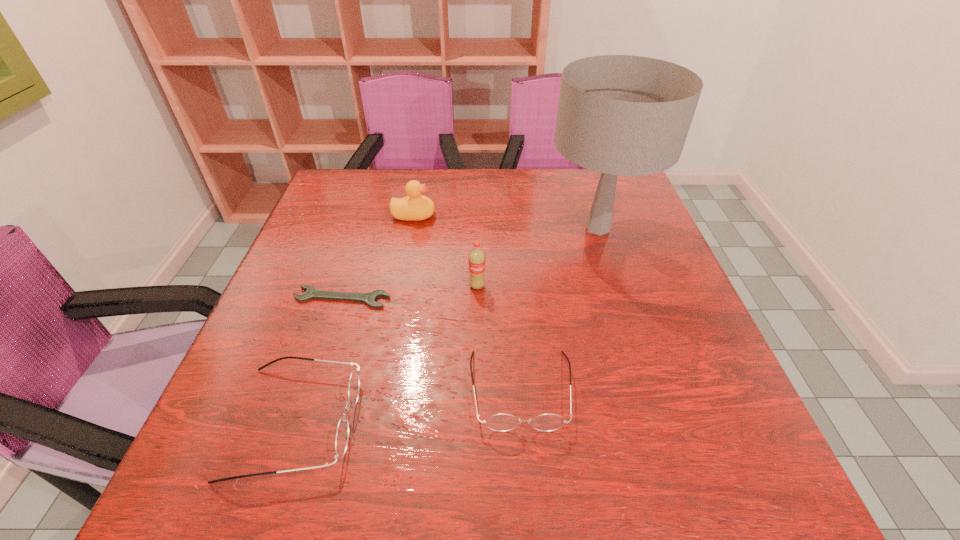
Find the location of a particular element. This screenshot has height=540, width=960. vacant space that satisfies the following two spatial constraints: 1. on the face of the duck; 2. on the left side of the soda is located at coordinates (400, 286).

The image size is (960, 540). In order to click on free space that satisfies the following two spatial constraints: 1. on the back side of the soda; 2. on the face of the fourth shortest object in this screenshot , I will do `click(478, 215)`.